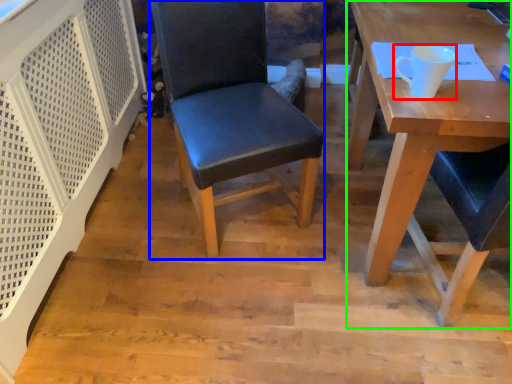
Question: Which object is the closest to the coffee cup (highlighted by a red box)? Choose among these: chair (highlighted by a blue box) or desk (highlighted by a green box).

Choices:
 (A) chair
 (B) desk

Answer: (B)